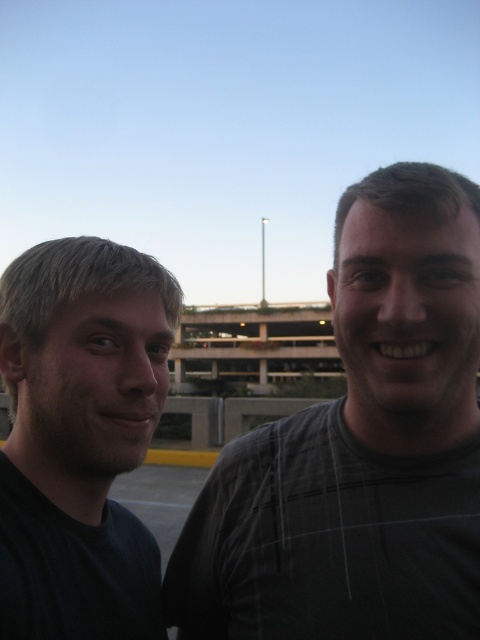
You are a photographer setting up for a group photo. You need to position the dark gray plaid shirt at right and the black matte shirt at left so that they are exactly 30 inches apart. Given their current distance, should you move them closer together or farther apart?

The dark gray plaid shirt at right is currently 27.67 inches from the black matte shirt at left. To reach the desired 30 inches, you should move them farther apart.

You are a photographer trying to capture a photo of both the dark gray plaid shirt at right and the black matte shirt at left. Since you want both subjects to be in the frame, which direction should you move your camera to include both?

To include both the dark gray plaid shirt at right and the black matte shirt at left in the frame, you should move your camera to the left. This adjustment will ensure that the black matte shirt at left remains centered while the dark gray plaid shirt at right stays within the frame.